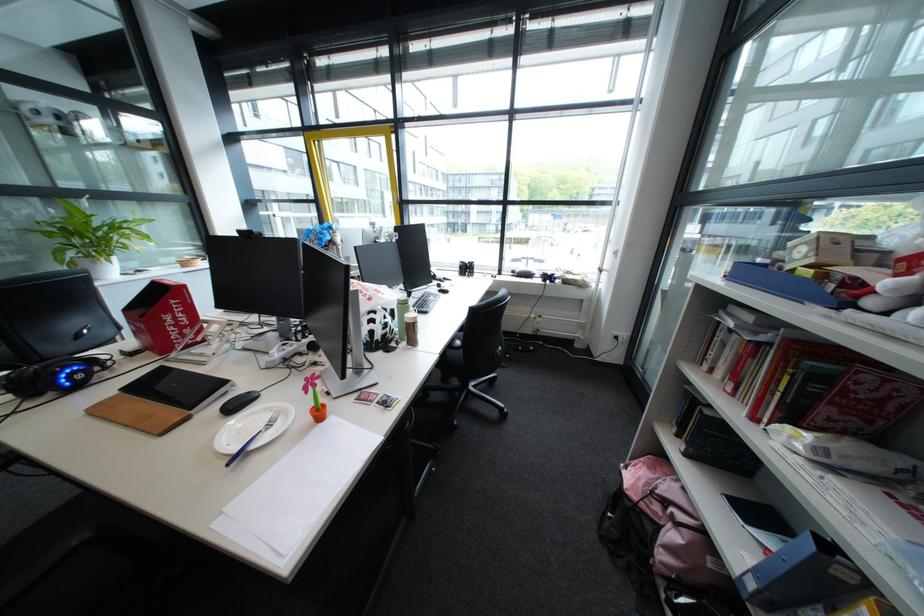
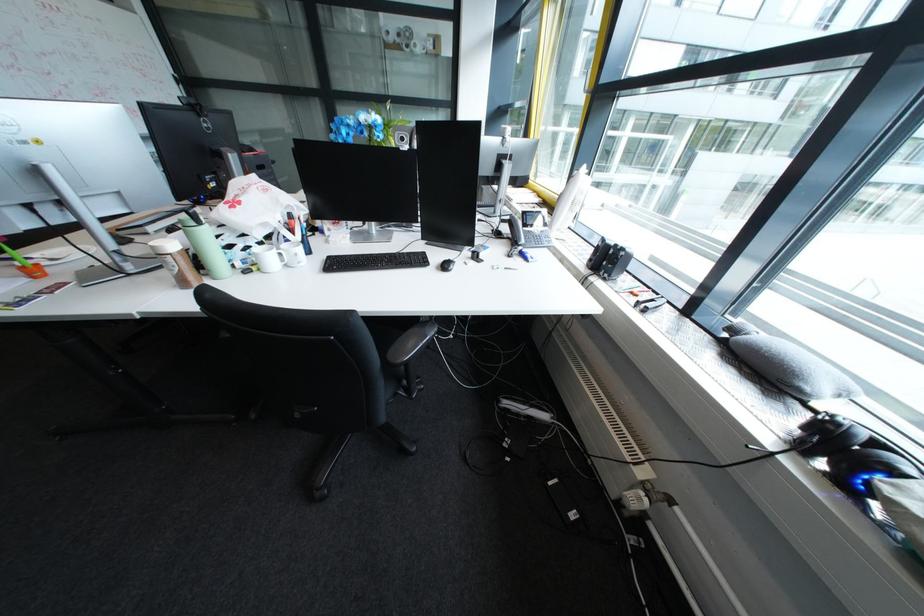
The point at (567, 275) is marked in the first image. Where is the corresponding point in the second image?

(909, 474)